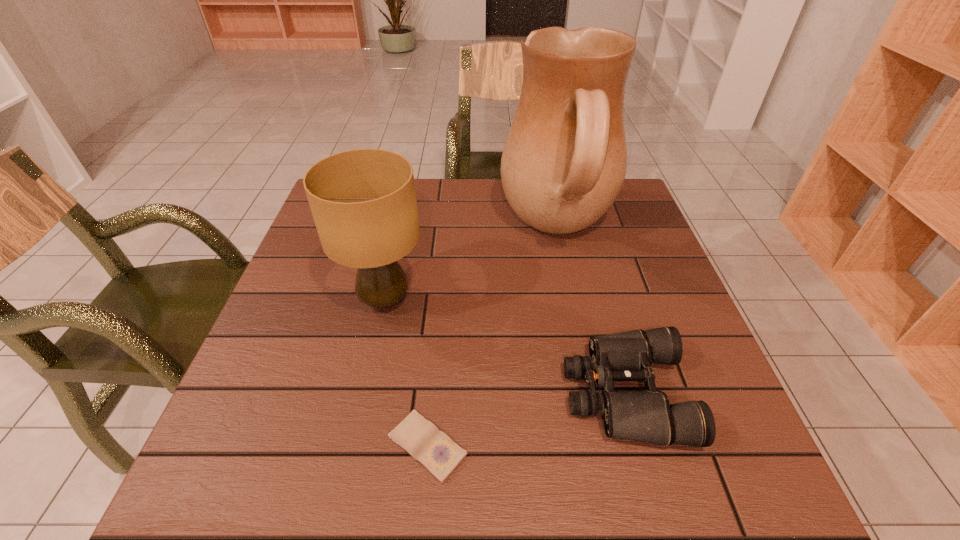
This screenshot has height=540, width=960. What are the coordinates of `object that is the third closest one to the binoculars` in the screenshot? It's located at (363, 201).

This screenshot has height=540, width=960. I want to click on the closest object to the second shortest object, so (564, 162).